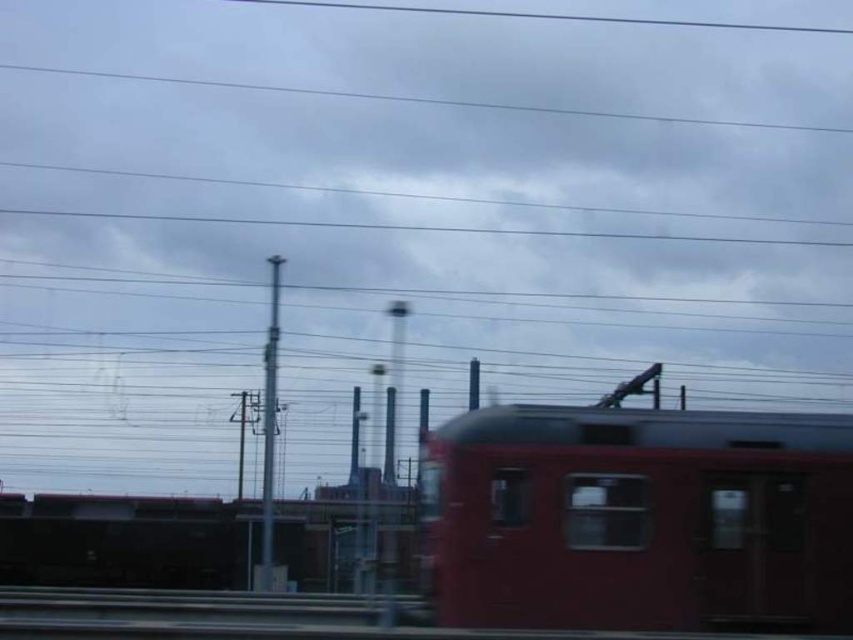
Is matte red train car at center above smooth wire at upper center?

Actually, matte red train car at center is below smooth wire at upper center.

Which is more to the right, matte red train car at center or smooth wire at upper center?

Positioned to the right is smooth wire at upper center.

Which is behind, point (469, 509) or point (712, 20)?

Point (712, 20)

Find the location of a particular element. matte red train car at center is located at coordinates pos(637,518).

Who is more distant from viewer, (830, 131) or (271, 497)?

The point (830, 131) is behind.

Can you confirm if metallic wire at upper center is positioned to the right of silver metallic pole at center?

Correct, you'll find metallic wire at upper center to the right of silver metallic pole at center.

The width and height of the screenshot is (853, 640). Describe the element at coordinates (421, 99) in the screenshot. I see `metallic wire at upper center` at that location.

Identify the location of metallic wire at upper center. (421, 99).

Between matte red train car at center and metallic wire at upper center, which one has less height?

metallic wire at upper center

Who is lower down, matte red train car at center or metallic wire at upper center?

matte red train car at center

Between point (492, 627) and point (303, 88), which one is positioned behind?

Positioned behind is point (303, 88).

This screenshot has height=640, width=853. I want to click on matte red train car at center, so click(637, 518).